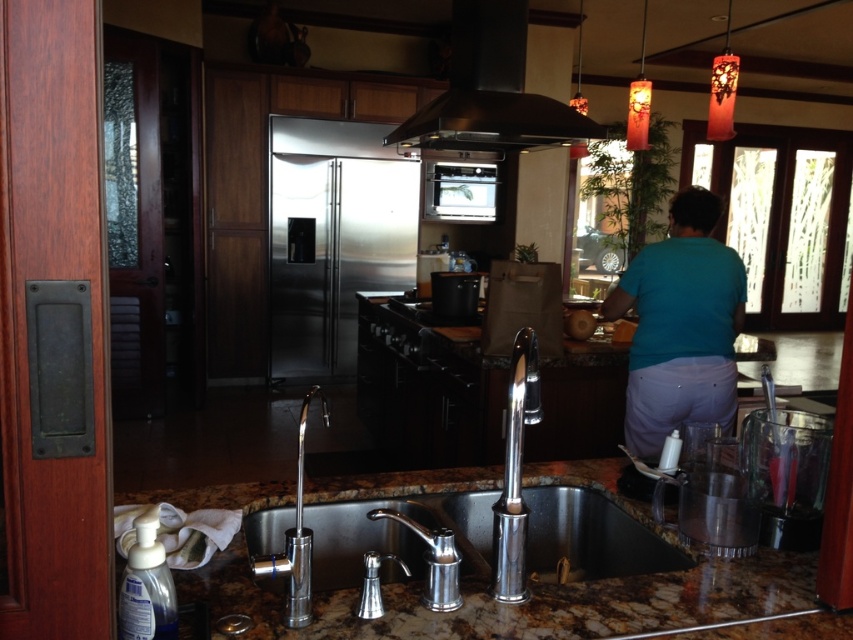
Question: Which of the following is the closest to the observer?

Choices:
 (A) (537, 499)
 (B) (297, 564)
 (C) (465, 200)
 (D) (706, 600)

Answer: (B)

Question: Which object appears farthest from the camera in this image?

Choices:
 (A) marble countertop at lower center
 (B) satin stainless steel oven at center
 (C) black matte exhaust hood at upper center
 (D) polished chrome faucet at sink center

Answer: (B)

Question: Among these points, which one is nearest to the camera?

Choices:
 (A) (422, 144)
 (B) (792, 618)
 (C) (801, 445)

Answer: (B)

Question: Is polished stainless steel sink at center above satin stainless steel oven at center?

Choices:
 (A) no
 (B) yes

Answer: (A)

Question: Where is polished stainless steel sink at center located in relation to black matte exhaust hood at upper center in the image?

Choices:
 (A) below
 (B) above

Answer: (A)

Question: Is the position of polished stainless steel sink at center less distant than that of satin stainless steel oven at center?

Choices:
 (A) no
 (B) yes

Answer: (B)